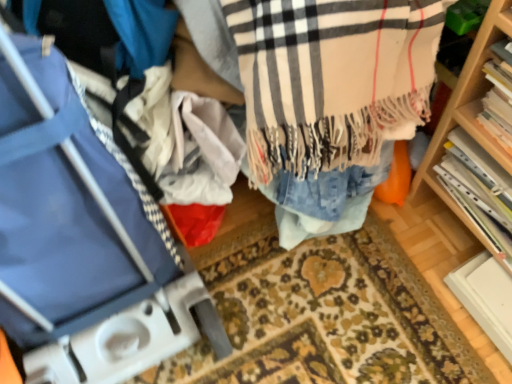
Question: Can you confirm if blue fabric luggage at left is smaller than hardcover book at right, arranged as the 2th book when viewed from the front?

Choices:
 (A) yes
 (B) no

Answer: (B)

Question: Is blue fabric luggage at left beside hardcover book at right, arranged as the 2th book when viewed from the front?

Choices:
 (A) no
 (B) yes

Answer: (A)

Question: Is blue fabric luggage at left not close to hardcover book at right, arranged as the 2th book when viewed from the front?

Choices:
 (A) yes
 (B) no

Answer: (B)

Question: Could you tell me if blue fabric luggage at left is turned towards hardcover book at right, arranged as the 2th book when viewed from the front?

Choices:
 (A) yes
 (B) no

Answer: (B)

Question: From the image's perspective, does blue fabric luggage at left appear lower than hardcover book at right, arranged as the 2th book when viewed from the front?

Choices:
 (A) yes
 (B) no

Answer: (B)

Question: Considering the positions of blue fabric luggage at left and hardcover book at right, which is counted as the second book, starting from the back, in the image, is blue fabric luggage at left taller or shorter than hardcover book at right, which is counted as the second book, starting from the back,?

Choices:
 (A) tall
 (B) short

Answer: (A)

Question: Is blue fabric luggage at left inside or outside of hardcover book at right, placed as the first book when sorted from front to back?

Choices:
 (A) outside
 (B) inside

Answer: (A)

Question: From a real-world perspective, is blue fabric luggage at left physically located above or below hardcover book at right, placed as the first book when sorted from front to back?

Choices:
 (A) above
 (B) below

Answer: (B)

Question: Is blue fabric luggage at left in front of or behind hardcover book at right, which is counted as the second book, starting from the back, in the image?

Choices:
 (A) behind
 (B) front

Answer: (B)

Question: Considering the positions of hardcover book at right, arranged as the 2th book when viewed from the front, and hardcover book at right, placed as the first book when sorted from front to back, in the image, is hardcover book at right, arranged as the 2th book when viewed from the front, wider or thinner than hardcover book at right, placed as the first book when sorted from front to back,?

Choices:
 (A) wide
 (B) thin

Answer: (A)

Question: Based on their positions, is hardcover book at right, arranged as the 2th book when viewed from the front, located to the left or right of hardcover book at right, placed as the first book when sorted from front to back?

Choices:
 (A) left
 (B) right

Answer: (B)

Question: Is hardcover book at right, the 1th book when ordered from back to front, inside the boundaries of hardcover book at right, placed as the first book when sorted from front to back, or outside?

Choices:
 (A) outside
 (B) inside

Answer: (A)

Question: From the image's perspective, relative to hardcover book at right, which is counted as the second book, starting from the back, is hardcover book at right, the 1th book when ordered from back to front, above or below?

Choices:
 (A) above
 (B) below

Answer: (B)

Question: From a real-world perspective, is beige plaid scarf at center physically located above or below hardcover book at right, the 1th book when ordered from back to front?

Choices:
 (A) above
 (B) below

Answer: (A)

Question: Is beige plaid scarf at center bigger or smaller than hardcover book at right, the 1th book when ordered from back to front?

Choices:
 (A) small
 (B) big

Answer: (B)